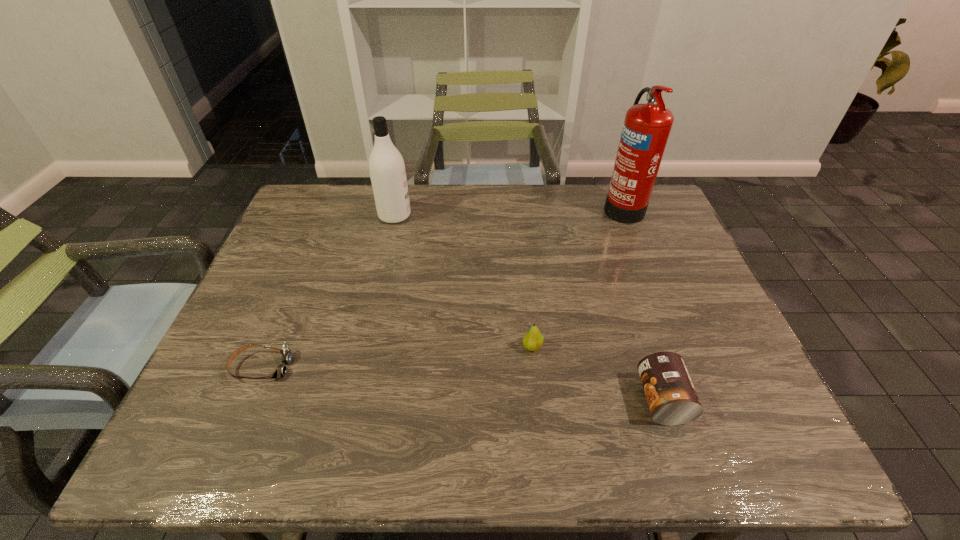
Find the location of a particular element. This screenshot has height=540, width=960. fire extinguisher is located at coordinates (646, 128).

Find the location of a particular element. The height and width of the screenshot is (540, 960). the second object from left to right is located at coordinates pos(387,170).

You are a GUI agent. You are given a task and a screenshot of the screen. Output one action in this format:
    pyautogui.click(x=<x>, y=<y>)
    Task: Click on the fourth shortest object
    This screenshot has height=540, width=960.
    Given the screenshot: What is the action you would take?
    pyautogui.click(x=387, y=170)

Locate an element on the screen. The width and height of the screenshot is (960, 540). the third object from right to left is located at coordinates (533, 340).

Locate an element on the screen. This screenshot has width=960, height=540. can is located at coordinates [672, 399].

The height and width of the screenshot is (540, 960). What are the coordinates of `the leftmost object` in the screenshot? It's located at (281, 370).

Locate an element on the screen. The image size is (960, 540). the shortest object is located at coordinates (281, 370).

Locate an element on the screen. vacant point located on the surface of the tallest object is located at coordinates (546, 206).

Image resolution: width=960 pixels, height=540 pixels. What are the coordinates of `free point located on the surface of the tallest object` in the screenshot? It's located at (534, 206).

The image size is (960, 540). I want to click on free space located on the surface of the tallest object, so click(x=484, y=206).